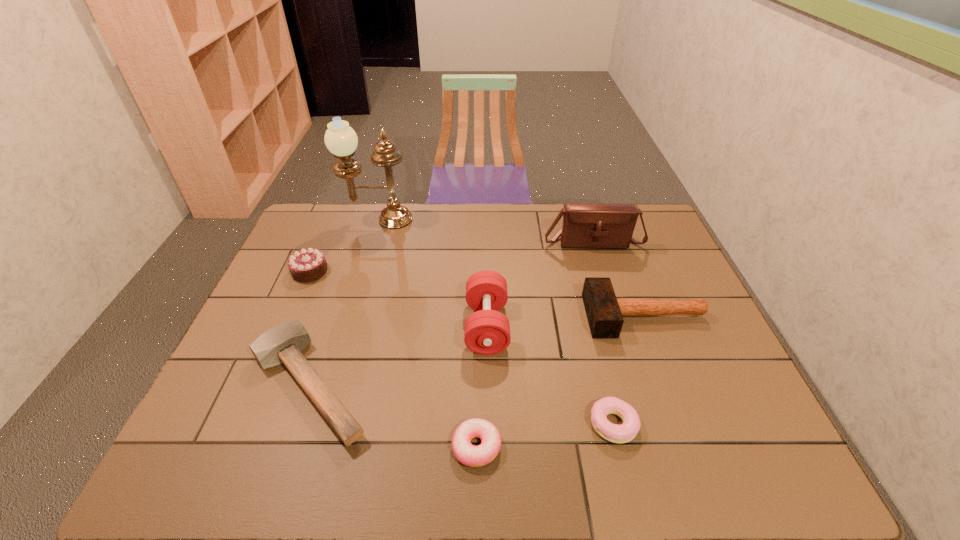
Where is `vacant space located 0.240m on the front of the farthest object`? The height and width of the screenshot is (540, 960). vacant space located 0.240m on the front of the farthest object is located at coordinates (362, 274).

Identify the location of vacant region located 0.240m on the front flap of the seventh shortest object. This screenshot has width=960, height=540. (612, 303).

I want to click on free space located 0.190m on the right of the dumbbell, so (x=577, y=326).

The image size is (960, 540). In order to click on vacant point located 0.130m on the front of the sixth nearest object in this screenshot , I will do `click(291, 314)`.

Where is `free space located on the hammer head face of the right mallet`? The height and width of the screenshot is (540, 960). free space located on the hammer head face of the right mallet is located at coordinates (537, 316).

What are the coordinates of `vacant space located 0.070m on the hammer head face of the right mallet` in the screenshot? It's located at (562, 316).

Where is `vacant point located on the hammer head face of the right mallet`? vacant point located on the hammer head face of the right mallet is located at coordinates (530, 316).

Locate an element on the screen. This screenshot has height=540, width=960. vacant region located on the back of the left mallet is located at coordinates (350, 264).

The image size is (960, 540). I want to click on vacant space situated on the left of the right doughnut, so click(x=439, y=424).

You are a GUI agent. You are given a task and a screenshot of the screen. Output one action in this format:
    pyautogui.click(x=<x>, y=<y>)
    Task: Click on the free region located 0.260m on the back of the left doughnut
    This screenshot has width=960, height=540.
    Given the screenshot: What is the action you would take?
    pyautogui.click(x=477, y=336)